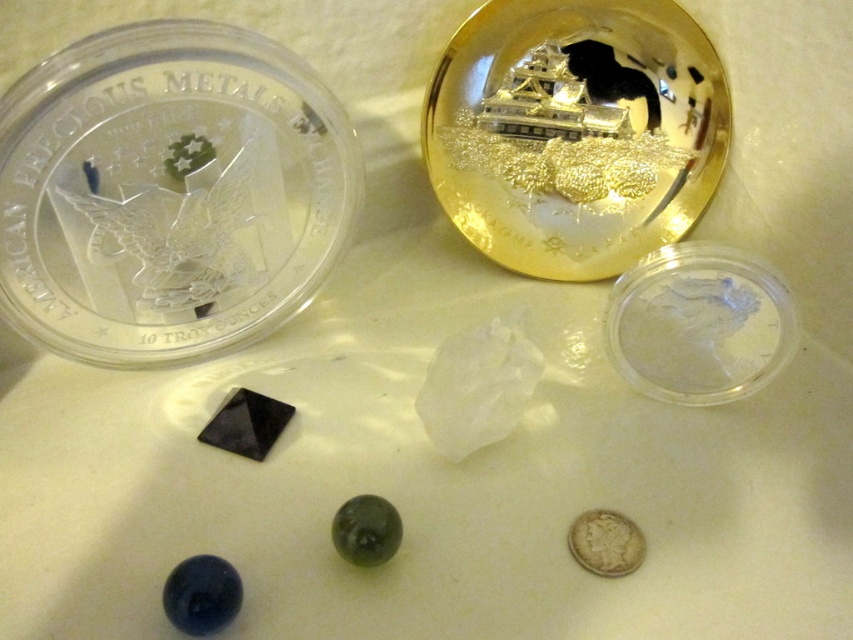
Question: Is clear plastic coin at upper left to the left of gold reflective coin at upper center from the viewer's perspective?

Choices:
 (A) yes
 (B) no

Answer: (A)

Question: Is gold reflective coin at upper center bigger than silver metallic coin at lower right?

Choices:
 (A) yes
 (B) no

Answer: (A)

Question: Which object is farther from the camera taking this photo?

Choices:
 (A) silver metallic coin at lower right
 (B) clear plastic coin at upper left

Answer: (A)

Question: Where is gold reflective coin at upper center located in relation to silver metallic coin at lower right in the image?

Choices:
 (A) below
 (B) above

Answer: (B)

Question: Estimate the real-world distances between objects in this image. Which object is closer to the clear plastic coin at upper left?

Choices:
 (A) silver metallic coin at lower right
 (B) gold reflective coin at upper center

Answer: (B)

Question: Which point is closer to the camera?

Choices:
 (A) (677, 44)
 (B) (282, 106)

Answer: (B)